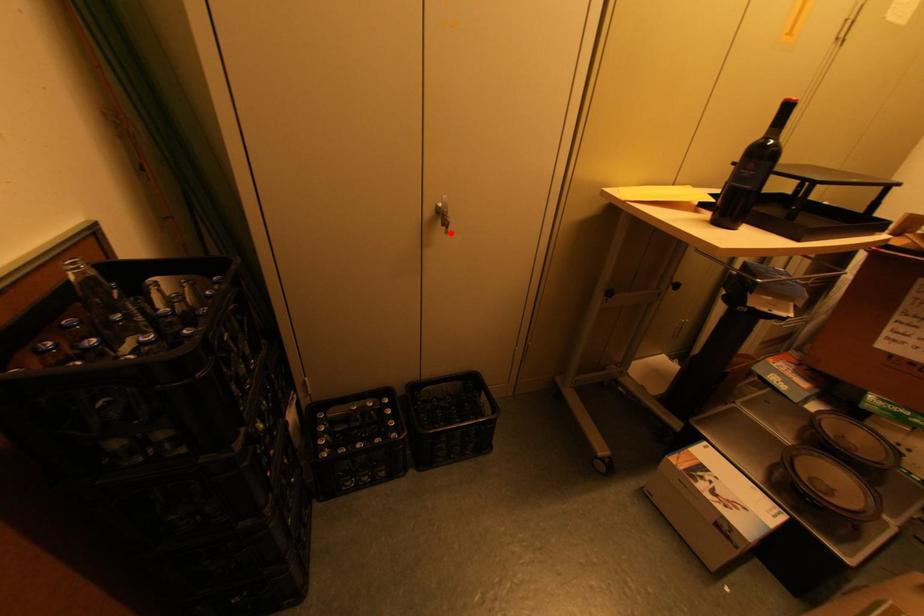
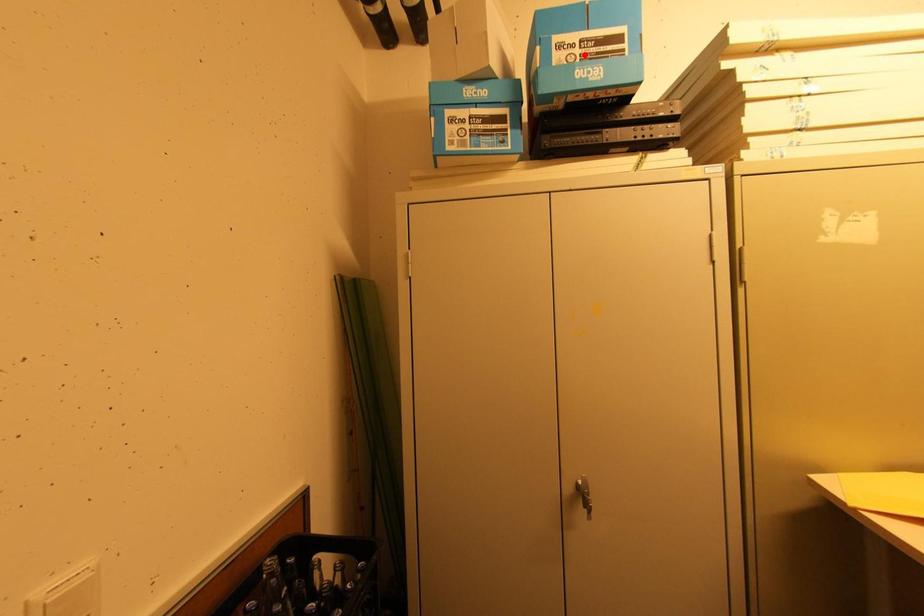
I am providing you with two images of the same scene from different viewpoints. A red point is marked on the first image and another point is marked on the second image. Does the point marked in image1 correspond to the same location as the one in image2?

No